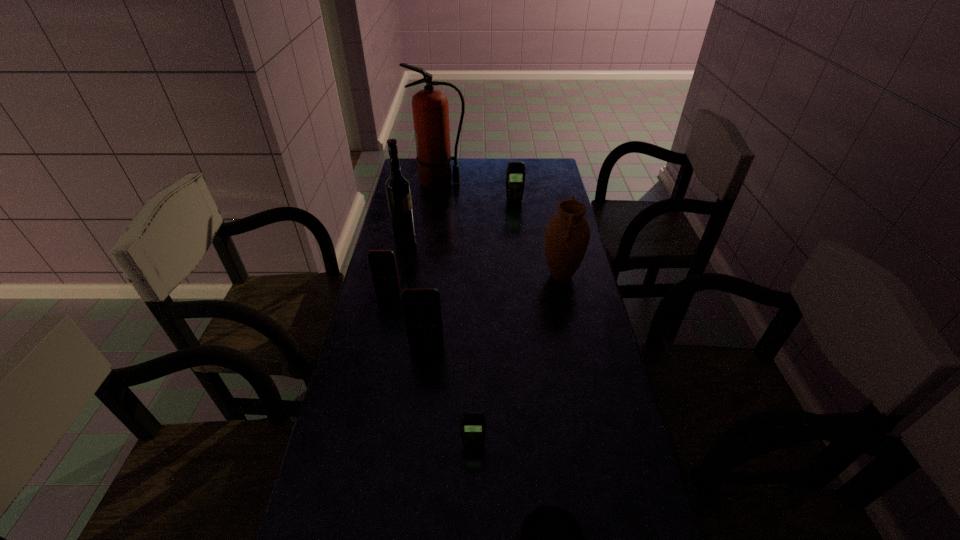
Identify the location of free space located on the screen of the nearer gray cellular telephone. The width and height of the screenshot is (960, 540). (472, 505).

Find the location of a particular element. object situated at the far edge is located at coordinates (430, 108).

Where is `fire extinguisher present at the left edge`? fire extinguisher present at the left edge is located at coordinates (430, 108).

Find the location of `wine bottle situated at the left edge`. wine bottle situated at the left edge is located at coordinates (398, 190).

You are a GUI agent. You are given a task and a screenshot of the screen. Output one action in this format:
    pyautogui.click(x=<x>, y=<y>)
    Task: Click on the object located in the right edge section of the desktop
    This screenshot has width=960, height=540.
    Given the screenshot: What is the action you would take?
    pyautogui.click(x=567, y=235)

Where is `object that is at the far left corner`? The width and height of the screenshot is (960, 540). object that is at the far left corner is located at coordinates (430, 108).

Where is `vacant position at the far edge of the desktop`? vacant position at the far edge of the desktop is located at coordinates (492, 184).

In order to click on free spot at the left edge of the desktop in this screenshot , I will do `click(388, 401)`.

The height and width of the screenshot is (540, 960). What are the coordinates of `free space at the right edge of the desktop` in the screenshot? It's located at (534, 199).

I want to click on vacant space at the far left corner of the desktop, so click(411, 175).